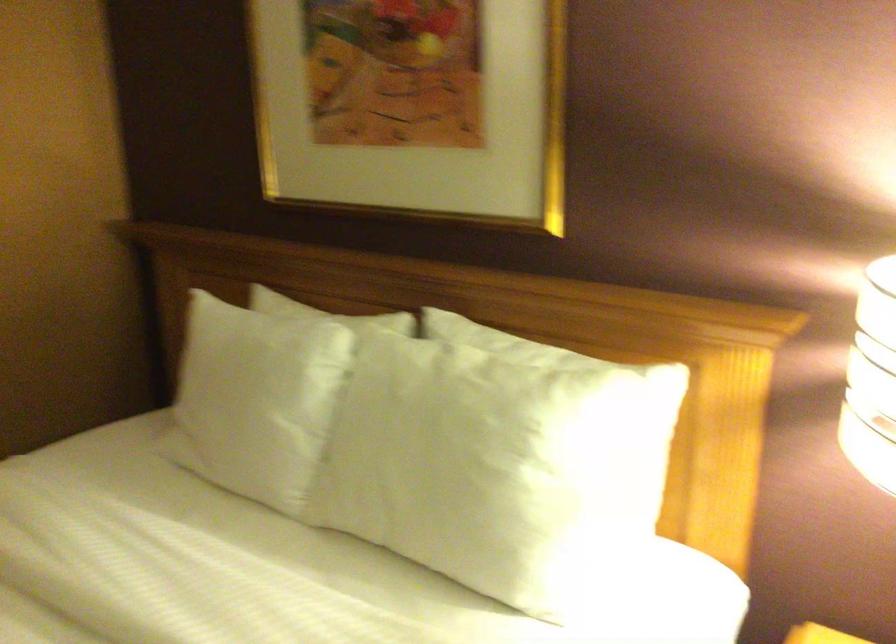
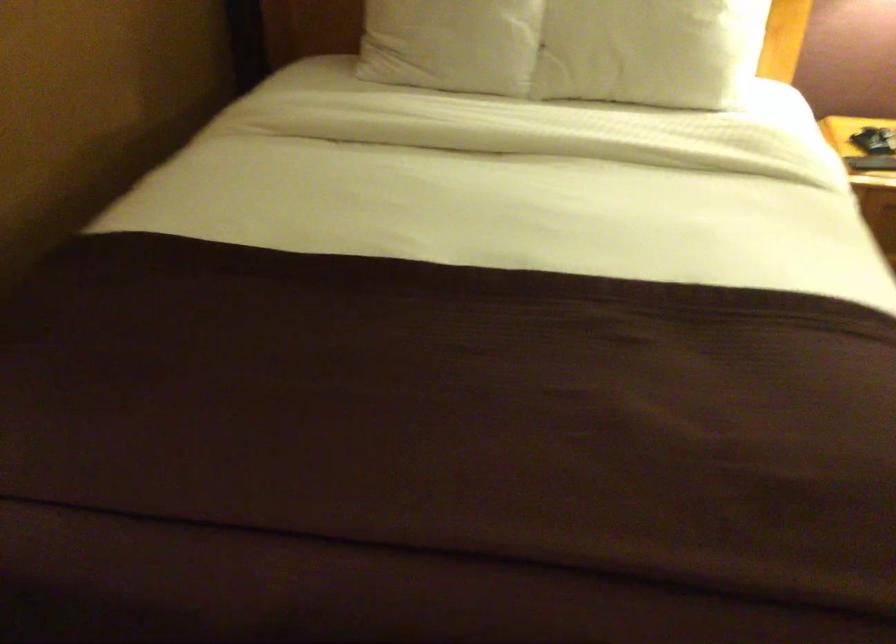
Find the pixel in the second image that matches (423,498) in the first image.

(649, 51)